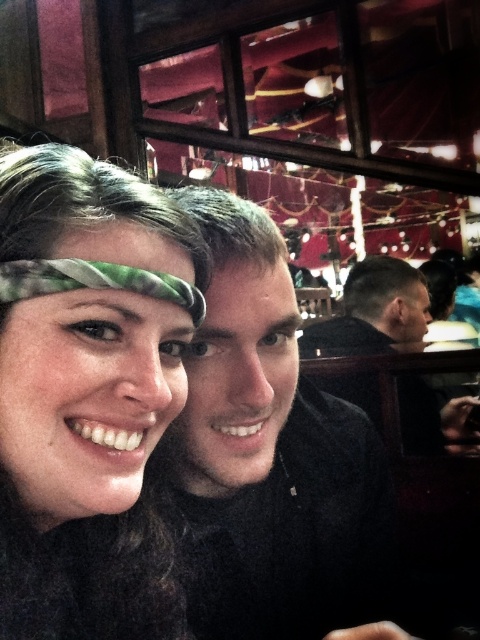
From the picture: You are a photographer trying to capture a perfect selfie of two people. The two people are located at point (120,234). The minimum distance required for your camera to focus properly is 18 inches. Based on the scene description, will the camera be able to focus on both subjects?

The two people are 17.51 inches apart, which is less than the minimum required distance of 18 inches for the camera to focus properly. Therefore, the camera may struggle to focus on both subjects clearly.

You are taking a photo of two people at a cafe. You notice the matte green headband at center and the black matte shirt at center. Which object is positioned higher in the image?

The matte green headband at center is located above the black matte shirt at center, so it is positioned higher in the image.

You are taking a photo with two friends, a woman and a man, in a cozy restaurant setting. You notice the matte green headband at center and the black matte shirt at center. Which object is closer to the camera?

The matte green headband at center is in front of the black matte shirt at center, so it is closer to the camera.